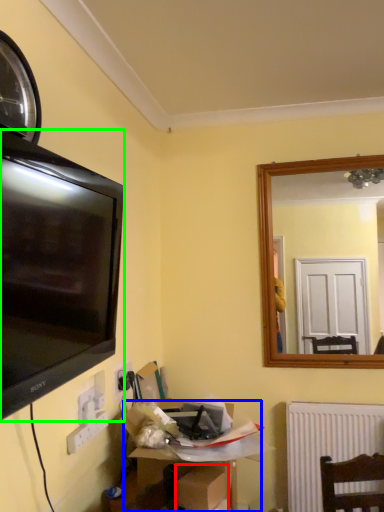
Question: Estimate the real-world distances between objects in this image. Which object is closer to cardboard box (highlighted by a red box), cardboard box (highlighted by a blue box) or television (highlighted by a green box)?

Choices:
 (A) cardboard box
 (B) television

Answer: (A)